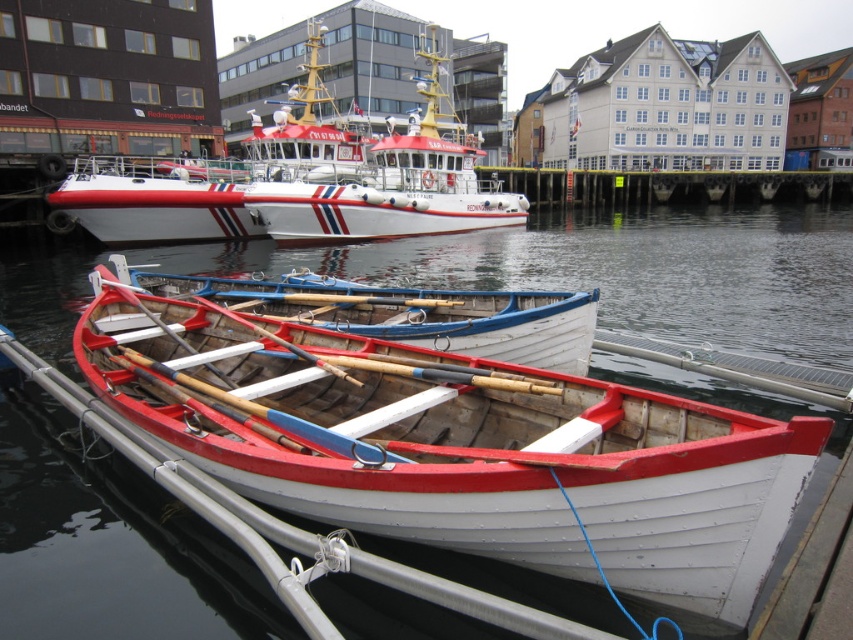
Question: Which object is closer to the camera taking this photo?

Choices:
 (A) wooden oars at center
 (B) wooden canoe at center

Answer: (B)

Question: Estimate the real-world distances between objects in this image. Which object is closer to the wooden oars at center?

Choices:
 (A) white glossy boat at upper center
 (B) wooden canoe at center

Answer: (B)

Question: Considering the relative positions of wooden canoe at center and white glossy boat at upper center in the image provided, where is wooden canoe at center located with respect to white glossy boat at upper center?

Choices:
 (A) below
 (B) above

Answer: (A)

Question: Which point appears closest to the camera in this image?

Choices:
 (A) (453, 349)
 (B) (523, 548)

Answer: (B)

Question: Does wooden canoe at center have a lesser width compared to white glossy boat at upper center?

Choices:
 (A) yes
 (B) no

Answer: (A)

Question: Is wooden canoe at center closer to the viewer compared to wooden oars at center?

Choices:
 (A) yes
 (B) no

Answer: (A)